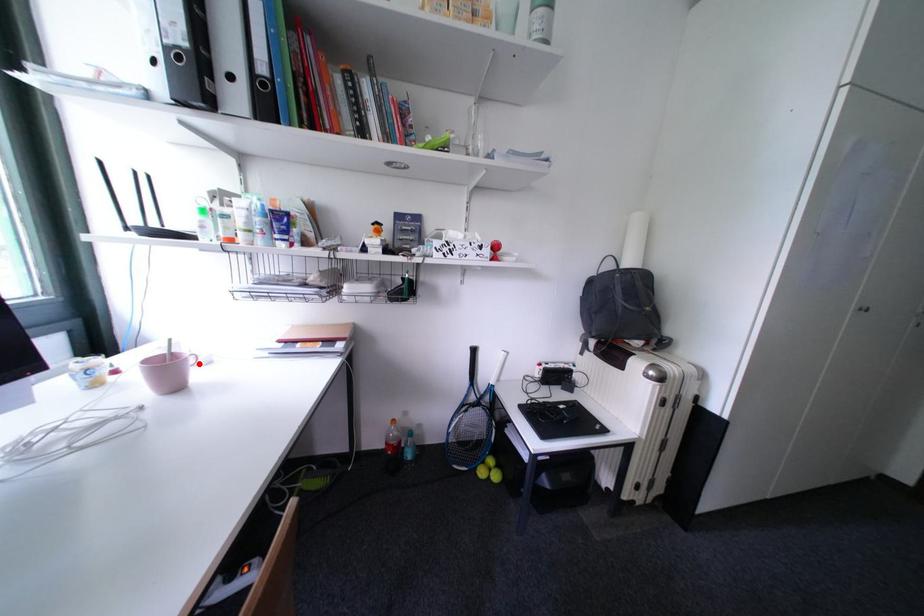
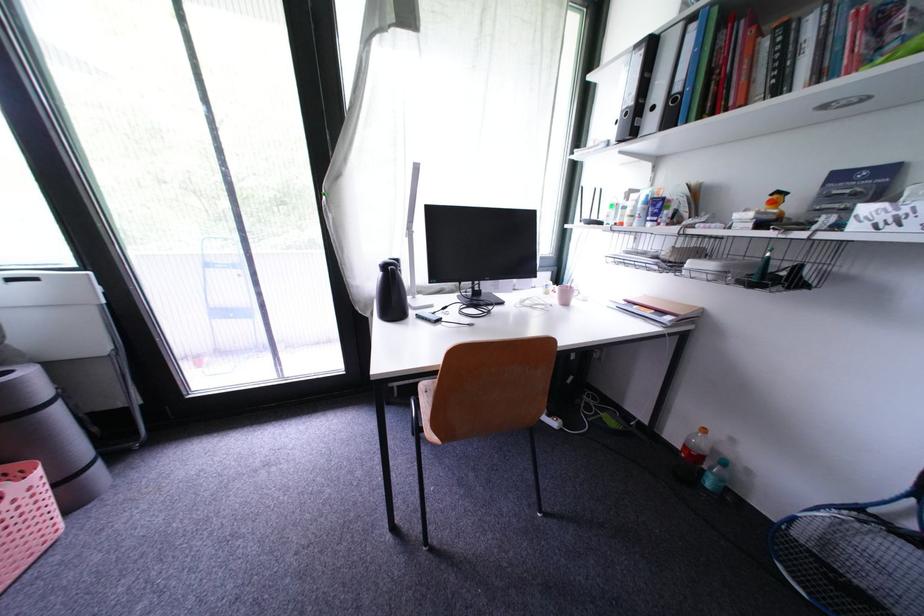
In the second image, find the point that corresponds to the highlighted location in the first image.

(584, 296)